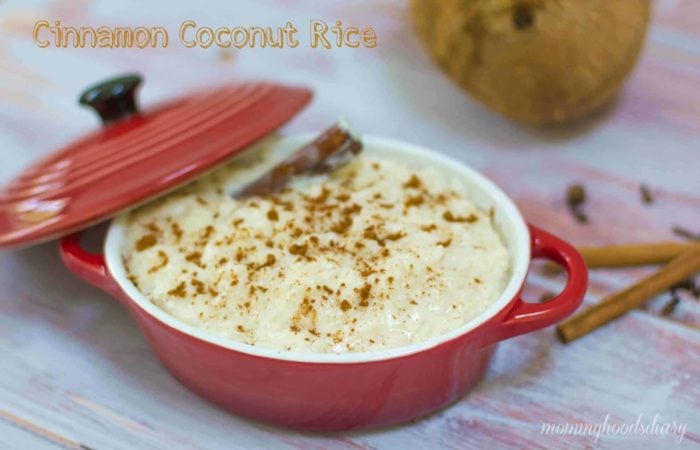
The height and width of the screenshot is (450, 700). Find the location of `cup cover`. cup cover is located at coordinates (158, 140).